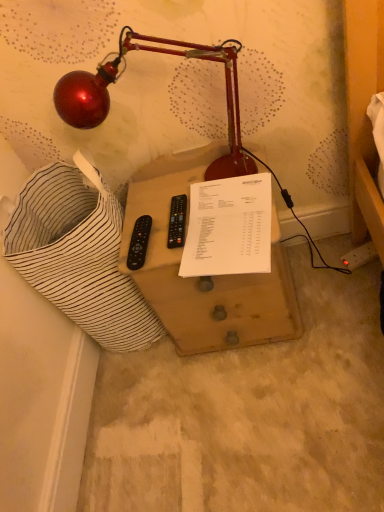
Where is `vacant area that lies in front of black plastic remote at center, marked as the 1th control in a right-to-left arrangement`? vacant area that lies in front of black plastic remote at center, marked as the 1th control in a right-to-left arrangement is located at coordinates (205, 248).